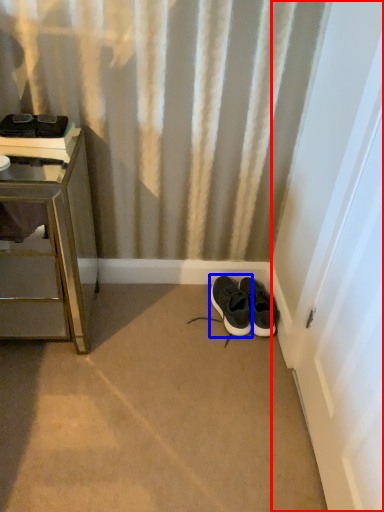
Question: Which object is further to the camera taking this photo, screen door (highlighted by a red box) or footwear (highlighted by a blue box)?

Choices:
 (A) screen door
 (B) footwear

Answer: (B)